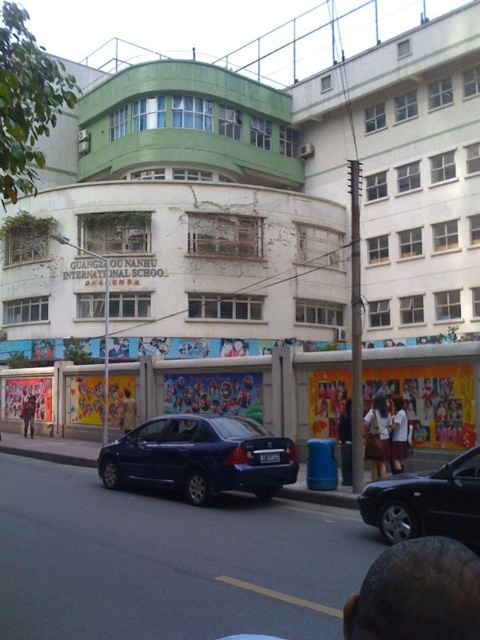
Who is higher up, dark blue metallic sedan at center or dark blue jeans at center?

dark blue metallic sedan at center

Consider the image. Is dark blue metallic sedan at center in front of dark blue jeans at center?

Yes, it is in front of dark blue jeans at center.

Who is more distant from viewer, (409,499) or (342,451)?

Point (342,451)

At what (x,y) coordinates should I click in order to perform the action: click on dark blue metallic sedan at center. Please return your answer as a coordinate pair (x, y). This screenshot has height=640, width=480. Looking at the image, I should click on (428, 502).

Between bald head at lower right and brown leather jacket at center, which one appears on the right side from the viewer's perspective?

From the viewer's perspective, bald head at lower right appears more on the right side.

Does bald head at lower right appear under brown leather jacket at center?

Actually, bald head at lower right is above brown leather jacket at center.

Measure the distance between bald head at lower right and camera.

They are 4.69 feet apart.

Locate an element on the screen. The width and height of the screenshot is (480, 640). bald head at lower right is located at coordinates (418, 593).

Looking at this image, between matte blue sedan at center and white fabric shirt at lower center, which one is positioned lower?

matte blue sedan at center

Who is higher up, matte blue sedan at center or white fabric shirt at lower center?

Positioned higher is white fabric shirt at lower center.

Find the location of `matte blue sedan at center`. matte blue sedan at center is located at coordinates (200, 458).

I want to click on matte blue sedan at center, so click(x=200, y=458).